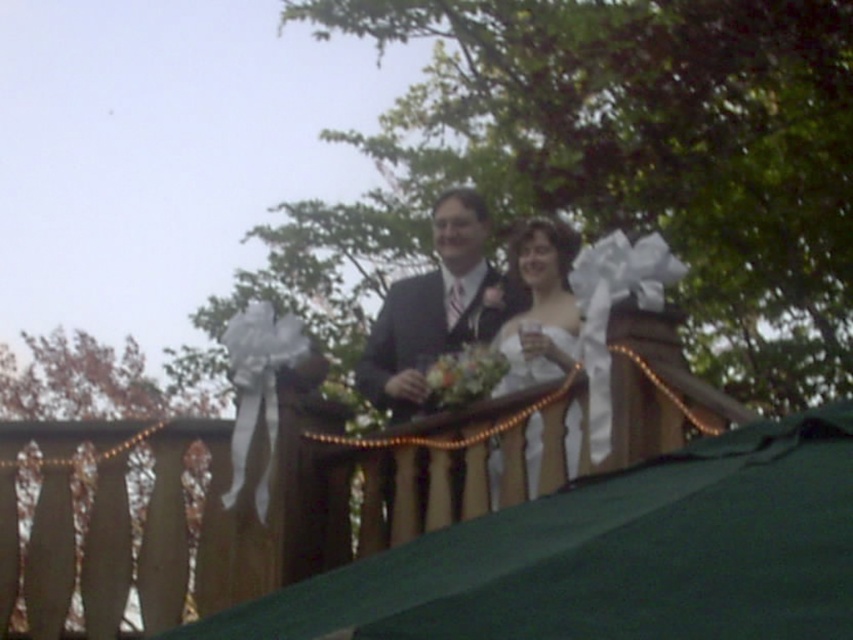
Question: Which object appears closest to the camera in this image?

Choices:
 (A) dark gray suit at center
 (B) green fabric canopy at upper center
 (C) white satin dress at center

Answer: (B)

Question: Is green fabric canopy at upper center to the right of white satin dress at center from the viewer's perspective?

Choices:
 (A) no
 (B) yes

Answer: (A)

Question: Is dark gray suit at center to the left of white satin dress at center from the viewer's perspective?

Choices:
 (A) no
 (B) yes

Answer: (B)

Question: Which of the following is the closest to the observer?

Choices:
 (A) white satin dress at center
 (B) dark gray suit at center

Answer: (A)

Question: Can you confirm if green fabric canopy at upper center is wider than white satin dress at center?

Choices:
 (A) no
 (B) yes

Answer: (B)

Question: Estimate the real-world distances between objects in this image. Which object is closer to the dark gray suit at center?

Choices:
 (A) green fabric canopy at upper center
 (B) white satin dress at center

Answer: (B)